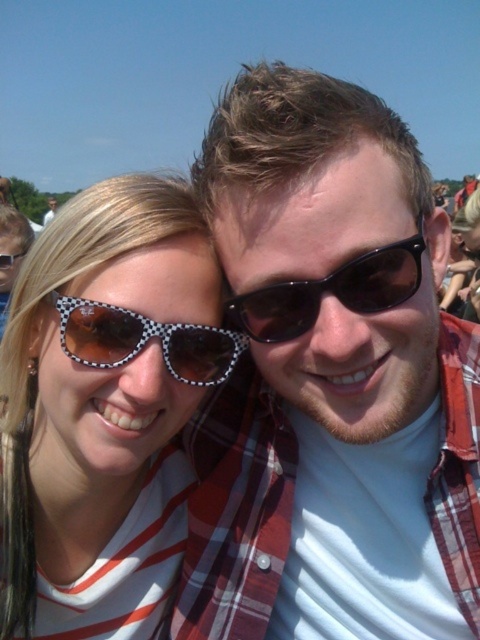
Can you confirm if checkered plastic sunglasses at upper left is bigger than matte black sunglasses at upper left?

Indeed, checkered plastic sunglasses at upper left has a larger size compared to matte black sunglasses at upper left.

In the scene shown: Can you confirm if checkered plastic sunglasses at upper left is positioned above matte black sunglasses at upper left?

No.

Between point (101, 340) and point (20, 252), which one is positioned in front?

Point (101, 340) is more forward.

Identify the location of checkered plastic sunglasses at upper left. The image size is (480, 640). point(144,340).

Measure the distance between polka dot sunglasses at left and matte black sunglasses at upper left.

polka dot sunglasses at left is 16.99 feet from matte black sunglasses at upper left.

I want to click on polka dot sunglasses at left, so click(x=104, y=410).

Who is lower down, polka dot sunglasses at left or black textured sunglasses at center?

polka dot sunglasses at left

Which is more to the right, polka dot sunglasses at left or black textured sunglasses at center?

black textured sunglasses at center

The image size is (480, 640). Identify the location of polka dot sunglasses at left. (104, 410).